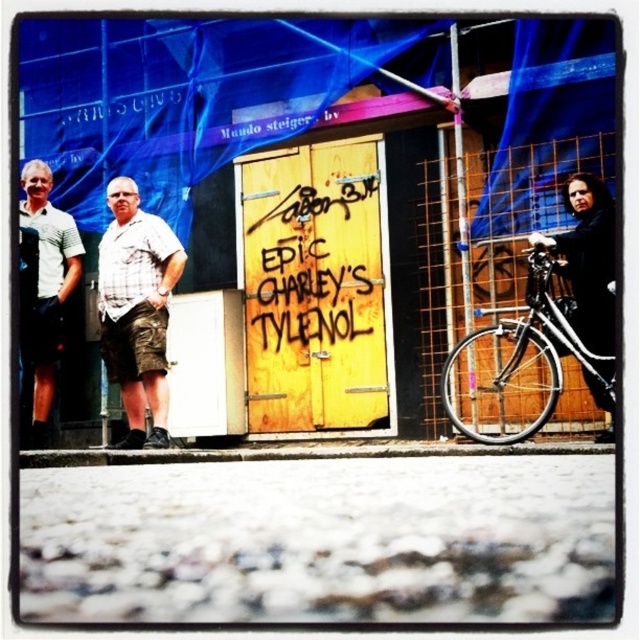
Question: Is plaid shirt at center closer to camera compared to matte black jacket at left?

Choices:
 (A) yes
 (B) no

Answer: (A)

Question: Estimate the real-world distances between objects in this image. Which object is farther from the black matte coat at right?

Choices:
 (A) plaid shirt at center
 (B) matte black jacket at left
 (C) shiny black bicycle at right

Answer: (B)

Question: Is yellow painted wood door at center thinner than black matte coat at right?

Choices:
 (A) no
 (B) yes

Answer: (A)

Question: Does yellow painted wood door at center lie in front of plaid shirt at center?

Choices:
 (A) yes
 (B) no

Answer: (B)

Question: Which of the following is the closest to the observer?

Choices:
 (A) black matte coat at right
 (B) matte black jacket at left
 (C) yellow painted wood door at center

Answer: (A)

Question: Estimate the real-world distances between objects in this image. Which object is farther from the plaid shirt at center?

Choices:
 (A) matte black jacket at left
 (B) black matte coat at right
 (C) yellow painted wood door at center

Answer: (B)